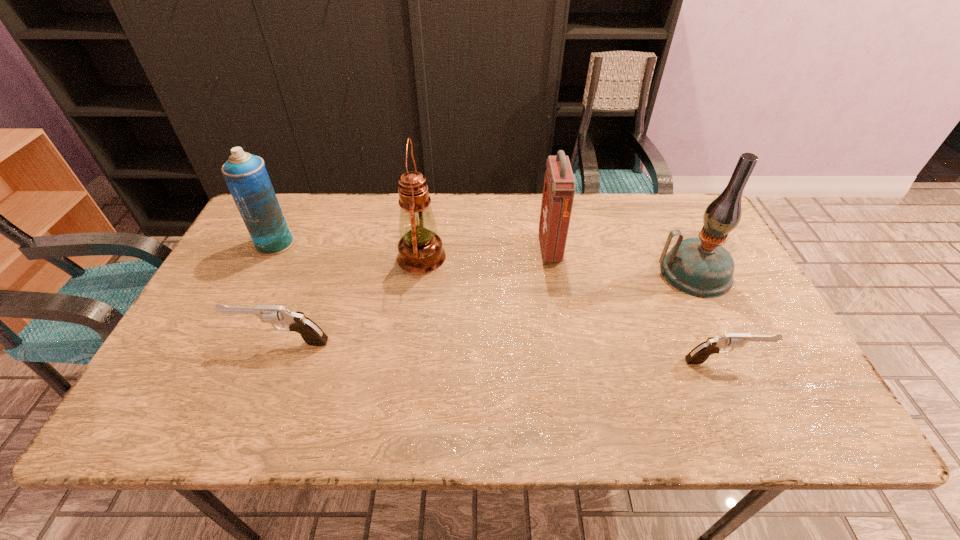
Image resolution: width=960 pixels, height=540 pixels. Find the location of `the second shortest object`. the second shortest object is located at coordinates pos(312,334).

The image size is (960, 540). I want to click on the taller gun, so click(312, 334).

Where is `the shortest object`? This screenshot has width=960, height=540. the shortest object is located at coordinates (698, 355).

The width and height of the screenshot is (960, 540). I want to click on the nearest object, so click(x=698, y=355).

This screenshot has height=540, width=960. Find the location of `the left oil lamp`. the left oil lamp is located at coordinates (420, 250).

At what (x,y) coordinates should I click in order to perform the action: click on the right oil lamp. Please return your answer as a coordinate pair (x, y). Looking at the image, I should click on (x=701, y=267).

Find the location of a particular element. This screenshot has height=540, width=960. aerosol can is located at coordinates (245, 174).

Where is `the first-aid kit`? The width and height of the screenshot is (960, 540). the first-aid kit is located at coordinates (559, 184).

What are the coordinates of `free location located 0.070m at the muzzle of the second shortest object` in the screenshot? It's located at (206, 342).

Locate an element on the screen. This screenshot has height=540, width=960. free space located 0.050m at the muzzle of the shorter gun is located at coordinates (784, 362).